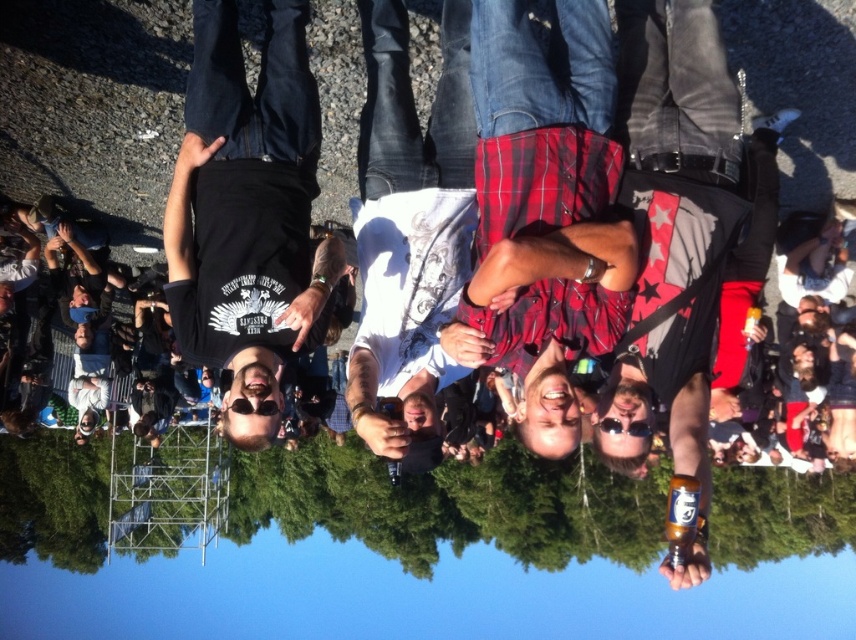
Can you confirm if red plaid shorts at center is thinner than black matte t-shirt at center?

Yes, red plaid shorts at center is thinner than black matte t-shirt at center.

Is red plaid shorts at center taller than black matte t-shirt at center?

Incorrect, red plaid shorts at center's height is not larger of black matte t-shirt at center's.

You are a GUI agent. You are given a task and a screenshot of the screen. Output one action in this format:
    pyautogui.click(x=<x>, y=<y>)
    Task: Click on the red plaid shorts at center
    The image size is (856, 640).
    Given the screenshot: What is the action you would take?
    pyautogui.click(x=545, y=205)

You are a GUI agent. You are given a task and a screenshot of the screen. Output one action in this format:
    pyautogui.click(x=<x>, y=<y>)
    Task: Click on the red plaid shorts at center
    This screenshot has height=640, width=856.
    Given the screenshot: What is the action you would take?
    pyautogui.click(x=545, y=205)

Who is positioned more to the left, transparent blue water at bottom or white printed t-shirt at center?

transparent blue water at bottom

Can you confirm if transparent blue water at bottom is positioned to the left of white printed t-shirt at center?

Yes, transparent blue water at bottom is to the left of white printed t-shirt at center.

Is point (103, 502) positioned after point (434, 353)?

Yes, point (103, 502) is farther from viewer.

Identify the location of transparent blue water at bottom. (423, 552).

Does black matte t-shirt at center come behind white printed t-shirt at center?

Yes, black matte t-shirt at center is further from the viewer.

Is point (276, 148) more distant than point (438, 220)?

Yes, point (276, 148) is farther from viewer.

The image size is (856, 640). I want to click on black matte t-shirt at center, so coord(247,214).

Locate an element on the screen. This screenshot has height=640, width=856. black matte t-shirt at center is located at coordinates (247, 214).